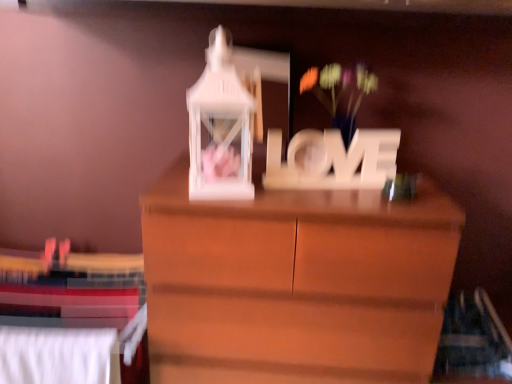
Question: Which is correct: white matte floral arrangement at center is inside wooden "love" sign at center, or outside of it?

Choices:
 (A) inside
 (B) outside

Answer: (B)

Question: Is white matte floral arrangement at center wider or thinner than wooden "love" sign at center?

Choices:
 (A) wide
 (B) thin

Answer: (A)

Question: Estimate the real-world distances between objects in this image. Which object is farther from the wooden "love" sign at center?

Choices:
 (A) white fabric bed at lower left
 (B) white matte floral arrangement at center

Answer: (A)

Question: Estimate the real-world distances between objects in this image. Which object is closer to the white matte floral arrangement at center?

Choices:
 (A) white fabric bed at lower left
 (B) wooden "love" sign at center

Answer: (B)